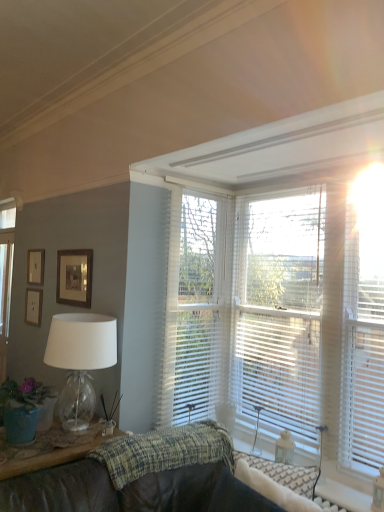
Image resolution: width=384 pixels, height=512 pixels. What do you see at coordinates (80, 361) in the screenshot?
I see `transparent glass lamp at left` at bounding box center [80, 361].

What are the coordinates of `wooden picture frame at upper left, positioned as the 2th picture frame in left-to-right order` in the screenshot? It's located at (35, 267).

What do you see at coordinates (74, 277) in the screenshot?
I see `wooden framed picture at upper left, which is the 3th picture frame from left to right` at bounding box center [74, 277].

The height and width of the screenshot is (512, 384). What do you see at coordinates (5, 296) in the screenshot?
I see `clear glass door at left` at bounding box center [5, 296].

Describe the element at coordinates (164, 451) in the screenshot. The image size is (384, 512). I see `textured woven blanket at center` at that location.

Identify the location of transparent glass lamp at left. The width and height of the screenshot is (384, 512). (80, 361).

Locate an element on the screen. This screenshot has width=384, height=512. glass door located on the left of wooden picture frame at upper left, marked as the 3th picture frame in a front-to-back arrangement is located at coordinates (5, 296).

Considering the positions of objects wooden picture frame at upper left, which appears as the third picture frame when viewed from the right, and clear glass door at left in the image provided, who is behind, wooden picture frame at upper left, which appears as the third picture frame when viewed from the right, or clear glass door at left?

Positioned behind is clear glass door at left.

Which of these two, wooden picture frame at upper left, marked as the 3th picture frame in a front-to-back arrangement, or clear glass door at left, is bigger?

Bigger between the two is clear glass door at left.

Is clear glass door at left at the right side of wooden framed picture at upper left, which is the first picture frame in front-to-back order?

No.

How different are the orientations of clear glass door at left and wooden framed picture at upper left, placed as the third picture frame when sorted from back to front, in degrees?

0.134 degrees.

From a real-world perspective, is clear glass door at left positioned over wooden framed picture at upper left, placed as the third picture frame when sorted from back to front, based on gravity?

No.

Does point (5, 290) come behind point (62, 258)?

Yes.

In the scene shown: Is white textured blinds at upper right shorter than wooden picture frame at upper left, positioned as the 2th picture frame in left-to-right order?

Incorrect, the height of white textured blinds at upper right does not fall short of that of wooden picture frame at upper left, positioned as the 2th picture frame in left-to-right order.

Is white textured blinds at upper right positioned with its back to wooden picture frame at upper left, positioned as the 2th picture frame in left-to-right order?

No.

From the image's perspective, who appears lower, white textured blinds at upper right or wooden picture frame at upper left, which appears as the second picture frame when viewed from the back?

white textured blinds at upper right.

Is white textured blinds at upper right wider or thinner than wooden picture frame at upper left, which appears as the second picture frame when viewed from the back?

Considering their sizes, white textured blinds at upper right looks broader than wooden picture frame at upper left, which appears as the second picture frame when viewed from the back.

Is point (166, 441) positioned before point (5, 334)?

Yes.

Is textured woven blanket at center aimed at clear glass door at left?

No, textured woven blanket at center does not turn towards clear glass door at left.

Between textured woven blanket at center and clear glass door at left, which one is positioned in front?

textured woven blanket at center is in front.

Which of these two, textured woven blanket at center or clear glass door at left, is bigger?

Bigger between the two is textured woven blanket at center.

Does white plastic blinds at right come in front of textured woven blanket at center?

No, the depth of white plastic blinds at right is greater than that of textured woven blanket at center.

From a real-world perspective, relative to textured woven blanket at center, is white plastic blinds at right vertically above or below?

white plastic blinds at right is above textured woven blanket at center.

In the scene shown: Is white plastic blinds at right far from textured woven blanket at center?

No, white plastic blinds at right is in close proximity to textured woven blanket at center.

Between white plastic blinds at right and textured woven blanket at center, which one has more height?

Standing taller between the two is white plastic blinds at right.

Would you say matte green pot at lower left is to the left or to the right of transparent glass lamp at left in the picture?

In the image, matte green pot at lower left appears on the left side of transparent glass lamp at left.

From the image's perspective, would you say matte green pot at lower left is shown under transparent glass lamp at left?

Indeed, from the image's perspective, matte green pot at lower left is shown beneath transparent glass lamp at left.

From a real-world perspective, is matte green pot at lower left physically below transparent glass lamp at left?

Yes, from a real-world perspective, matte green pot at lower left is below transparent glass lamp at left.

How different are the orientations of matte green pot at lower left and transparent glass lamp at left in degrees?

matte green pot at lower left and transparent glass lamp at left are facing 0.000549 degrees away from each other.

From a real-world perspective, is wooden framed picture at upper left, which is the first picture frame in front-to-back order, on wooden picture frame at upper left, which appears as the third picture frame when viewed from the right?

Indeed, from a real-world perspective, wooden framed picture at upper left, which is the first picture frame in front-to-back order, stands above wooden picture frame at upper left, which appears as the third picture frame when viewed from the right.

Could you tell me if wooden framed picture at upper left, placed as the third picture frame when sorted from back to front, is turned towards wooden picture frame at upper left, which is the 1th picture frame from left to right?

No, wooden framed picture at upper left, placed as the third picture frame when sorted from back to front, is not turned towards wooden picture frame at upper left, which is the 1th picture frame from left to right.

Is wooden framed picture at upper left, which is the 3th picture frame from left to right, positioned beyond the bounds of wooden picture frame at upper left, marked as the 3th picture frame in a front-to-back arrangement?

Yes, wooden framed picture at upper left, which is the 3th picture frame from left to right, is located beyond the bounds of wooden picture frame at upper left, marked as the 3th picture frame in a front-to-back arrangement.

What's the angular difference between wooden framed picture at upper left, which is the first picture frame in front-to-back order, and wooden picture frame at upper left, which appears as the third picture frame when viewed from the right,'s facing directions?

They differ by 0.482 degrees in their facing directions.

From the image's perspective, starting from the clear glass door at left, which picture frame is the 1st one above? Please provide its 2D coordinates.

[(33, 306)]

The image size is (384, 512). I want to click on the 3rd picture frame in front of the clear glass door at left, counting from the anchor's position, so click(74, 277).

Estimate the real-world distances between objects in this image. Which object is further from textured woven blanket at center, translucent white blinds at upper right or white plastic blinds at right?

white plastic blinds at right.

Estimate the real-world distances between objects in this image. Which object is further from white textured blinds at upper right, wooden picture frame at upper left, which is the 1th picture frame from left to right, or transparent glass lamp at left?

Among the two, wooden picture frame at upper left, which is the 1th picture frame from left to right, is located further to white textured blinds at upper right.

Based on their spatial positions, is white plastic blinds at right or clear glass door at left closer to wooden framed picture at upper left, which is the 3th picture frame from left to right?

Based on the image, clear glass door at left appears to be nearer to wooden framed picture at upper left, which is the 3th picture frame from left to right.

Estimate the real-world distances between objects in this image. Which object is further from translucent white blinds at upper right, brown leather couch at lower left or white textured blinds at upper right?

Among the two, brown leather couch at lower left is located further to translucent white blinds at upper right.

Which object lies nearer to the anchor point wooden picture frame at upper left, which appears as the third picture frame when viewed from the right, clear glass door at left or white textured blinds at upper right?

clear glass door at left is closer to wooden picture frame at upper left, which appears as the third picture frame when viewed from the right.

From the image, which object appears to be farther from translucent white blinds at upper right, white textured blinds at upper right or brown leather couch at lower left?

The object further to translucent white blinds at upper right is brown leather couch at lower left.

Consider the image. Considering their positions, is transparent glass lamp at left positioned further to wooden framed picture at upper left, which is the 3th picture frame from left to right, than white textured blinds at upper right?

Based on the image, white textured blinds at upper right appears to be further to wooden framed picture at upper left, which is the 3th picture frame from left to right.

Which object lies nearer to the anchor point white textured blinds at upper right, brown leather couch at lower left or transparent glass lamp at left?

brown leather couch at lower left lies closer to white textured blinds at upper right than the other object.

Identify the location of blind between brown leather couch at lower left and white textured blinds at upper right from front to back. (363, 325).

Identify the location of houseplant between clear glass door at left and white plastic blinds at right from left to right. (22, 408).

Where is `window blind between clear glass door at left and white plastic blinds at right in the horizontal direction`? The image size is (384, 512). window blind between clear glass door at left and white plastic blinds at right in the horizontal direction is located at coordinates (280, 305).

The image size is (384, 512). Identify the location of lamp between textured woven blanket at center and wooden framed picture at upper left, the 1th picture frame positioned from the right, in the front-back direction. (80, 361).